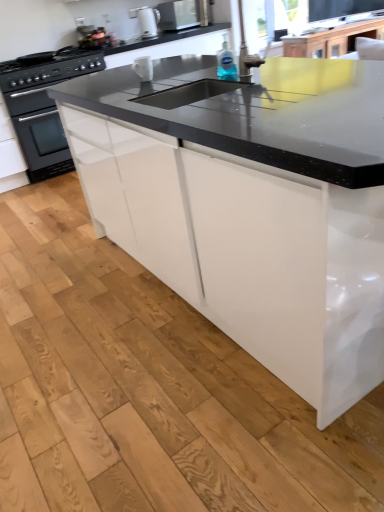
Describe the element at coordinates (146, 20) in the screenshot. The width and height of the screenshot is (384, 512). I see `white glossy electric kettle at upper center, positioned as the 2th appliance in front-to-back order` at that location.

I want to click on satin silver microwave at upper center, so click(x=184, y=14).

Locate an element on the screen. This screenshot has width=384, height=512. black matte oven at left is located at coordinates (43, 106).

In terms of width, does transparent plastic bottle at upper center look wider or thinner when compared to white glossy mug at upper center, the first appliance from the front?

Considering their sizes, transparent plastic bottle at upper center looks slimmer than white glossy mug at upper center, the first appliance from the front.

Is point (232, 74) more distant than point (149, 61)?

No, (232, 74) is closer to viewer.

From a real-world perspective, who is located lower, transparent plastic bottle at upper center or white glossy mug at upper center, the first appliance from the front?

white glossy mug at upper center, the first appliance from the front, is physically lower.

Can you tell me how much white glossy mug at upper center, which appears as the first appliance when viewed from the right, and white glossy electric kettle at upper center, placed as the first appliance when sorted from back to front, differ in facing direction?

The angular difference between white glossy mug at upper center, which appears as the first appliance when viewed from the right, and white glossy electric kettle at upper center, placed as the first appliance when sorted from back to front, is 95.2 degrees.

Could you measure the distance between white glossy mug at upper center, the first appliance from the front, and white glossy electric kettle at upper center, which appears as the 1th appliance when viewed from the top?

white glossy mug at upper center, the first appliance from the front, and white glossy electric kettle at upper center, which appears as the 1th appliance when viewed from the top, are 7.82 feet apart from each other.

Considering the sizes of white glossy mug at upper center, the 2th appliance when ordered from back to front, and white glossy electric kettle at upper center, arranged as the 1th appliance when viewed from the left, in the image, is white glossy mug at upper center, the 2th appliance when ordered from back to front, wider or thinner than white glossy electric kettle at upper center, arranged as the 1th appliance when viewed from the left,?

Clearly, white glossy mug at upper center, the 2th appliance when ordered from back to front, has less width compared to white glossy electric kettle at upper center, arranged as the 1th appliance when viewed from the left.

Considering the positions of points (134, 61) and (141, 30), is point (134, 61) farther from camera compared to point (141, 30)?

That is False.

Looking at this image, how distant is transparent plastic bottle at upper center from satin silver microwave at upper center?

The distance of transparent plastic bottle at upper center from satin silver microwave at upper center is 9.31 feet.

Which object is thinner, transparent plastic bottle at upper center or satin silver microwave at upper center?

With smaller width is transparent plastic bottle at upper center.

From a real-world perspective, does transparent plastic bottle at upper center sit lower than satin silver microwave at upper center?

Yes, from a real-world perspective, transparent plastic bottle at upper center is under satin silver microwave at upper center.

Is transparent plastic bottle at upper center to the right of satin silver microwave at upper center from the viewer's perspective?

Yes.

Is satin silver microwave at upper center facing towards white glossy mug at upper center, the first appliance when ordered from bottom to top?

No, satin silver microwave at upper center is not facing towards white glossy mug at upper center, the first appliance when ordered from bottom to top.

Is satin silver microwave at upper center with white glossy mug at upper center, the first appliance from the front?

No, satin silver microwave at upper center is not with white glossy mug at upper center, the first appliance from the front.

Does satin silver microwave at upper center appear on the left side of white glossy mug at upper center, the first appliance from the front?

In fact, satin silver microwave at upper center is to the right of white glossy mug at upper center, the first appliance from the front.

From a real-world perspective, between satin silver microwave at upper center and transparent plastic bottle at upper center, who is vertically higher?

From a 3D spatial view, satin silver microwave at upper center is above.

Is transparent plastic bottle at upper center inside satin silver microwave at upper center?

No, transparent plastic bottle at upper center is located outside of satin silver microwave at upper center.

Which is more to the right, satin silver microwave at upper center or transparent plastic bottle at upper center?

transparent plastic bottle at upper center.

Locate an element on the screen. The height and width of the screenshot is (512, 384). kitchen appliance that appears above the transparent plastic bottle at upper center (from a real-world perspective) is located at coordinates (184, 14).

Is satin silver microwave at upper center to the left or to the right of black matte oven at left in the image?

From the image, it's evident that satin silver microwave at upper center is to the right of black matte oven at left.

From a real-world perspective, between satin silver microwave at upper center and black matte oven at left, who is vertically higher?

satin silver microwave at upper center, from a real-world perspective.

Is satin silver microwave at upper center beside black matte oven at left?

satin silver microwave at upper center and black matte oven at left are not in contact.

How many degrees apart are the facing directions of satin silver microwave at upper center and black matte oven at left?

1.74 degrees separate the facing orientations of satin silver microwave at upper center and black matte oven at left.

From a real-world perspective, between white glossy electric kettle at upper center, arranged as the 1th appliance when viewed from the left, and satin silver microwave at upper center, who is vertically lower?

satin silver microwave at upper center is physically lower.

Based on the photo, is white glossy electric kettle at upper center, arranged as the 1th appliance when viewed from the left, not within satin silver microwave at upper center?

white glossy electric kettle at upper center, arranged as the 1th appliance when viewed from the left, lies outside satin silver microwave at upper center's area.

How different are the orientations of white glossy electric kettle at upper center, positioned as the 2th appliance in front-to-back order, and satin silver microwave at upper center in degrees?

0.658 degrees separate the facing orientations of white glossy electric kettle at upper center, positioned as the 2th appliance in front-to-back order, and satin silver microwave at upper center.

Does point (152, 14) lie behind point (193, 12)?

No.

Identify the location of bottle lying below the white glossy mug at upper center, which appears as the first appliance when viewed from the right (from the image's perspective). The height and width of the screenshot is (512, 384). (226, 63).

Identify the location of appliance above the white glossy mug at upper center, the second appliance when ordered from left to right (from a real-world perspective). [x=146, y=20].

Considering their positions, is black matte oven at left positioned further to satin silver microwave at upper center than white glossy mug at upper center, the first appliance from the front?

white glossy mug at upper center, the first appliance from the front.

Which object lies further to the anchor point satin silver microwave at upper center, white glossy electric kettle at upper center, marked as the 2th appliance in a bottom-to-top arrangement, or black matte oven at left?

black matte oven at left is positioned further to the anchor satin silver microwave at upper center.

Based on their spatial positions, is transparent plastic bottle at upper center or satin silver microwave at upper center further from white glossy mug at upper center, which appears as the first appliance when viewed from the right?

Among the two, satin silver microwave at upper center is located further to white glossy mug at upper center, which appears as the first appliance when viewed from the right.

Estimate the real-world distances between objects in this image. Which object is further from satin silver microwave at upper center, white glossy electric kettle at upper center, marked as the 2th appliance in a bottom-to-top arrangement, or white glossy mug at upper center, which appears as the first appliance when viewed from the right?

white glossy mug at upper center, which appears as the first appliance when viewed from the right, is further to satin silver microwave at upper center.

From the image, which object appears to be farther from transparent plastic bottle at upper center, black matte oven at left or satin silver microwave at upper center?

Based on the image, satin silver microwave at upper center appears to be further to transparent plastic bottle at upper center.

Estimate the real-world distances between objects in this image. Which object is further from white glossy mug at upper center, the first appliance from the front, black matte oven at left or white glossy electric kettle at upper center, which is counted as the 2th appliance, starting from the right?

The object further to white glossy mug at upper center, the first appliance from the front, is white glossy electric kettle at upper center, which is counted as the 2th appliance, starting from the right.

Estimate the real-world distances between objects in this image. Which object is closer to satin silver microwave at upper center, white glossy mug at upper center, the second appliance when ordered from left to right, or black matte oven at left?

The object closer to satin silver microwave at upper center is black matte oven at left.

Estimate the real-world distances between objects in this image. Which object is further from white glossy mug at upper center, the first appliance from the front, satin silver microwave at upper center or black matte oven at left?

satin silver microwave at upper center.

At what (x,y) coordinates should I click in order to perform the action: click on home appliance between transparent plastic bottle at upper center and satin silver microwave at upper center along the z-axis. Please return your answer as a coordinate pair (x, y). The width and height of the screenshot is (384, 512). Looking at the image, I should click on (43, 106).

In order to click on appliance between satin silver microwave at upper center and black matte oven at left from top to bottom in this screenshot , I will do `click(146, 20)`.

You are a GUI agent. You are given a task and a screenshot of the screen. Output one action in this format:
    pyautogui.click(x=<x>, y=<y>)
    Task: Click on the appliance located between transparent plastic bottle at upper center and white glossy electric kettle at upper center, placed as the first appliance when sorted from back to front, in the depth direction
    The image size is (384, 512).
    Given the screenshot: What is the action you would take?
    pyautogui.click(x=143, y=68)

At what (x,y) coordinates should I click in order to perform the action: click on appliance between transparent plastic bottle at upper center and black matte oven at left in the front-back direction. Please return your answer as a coordinate pair (x, y). This screenshot has width=384, height=512. Looking at the image, I should click on (143, 68).